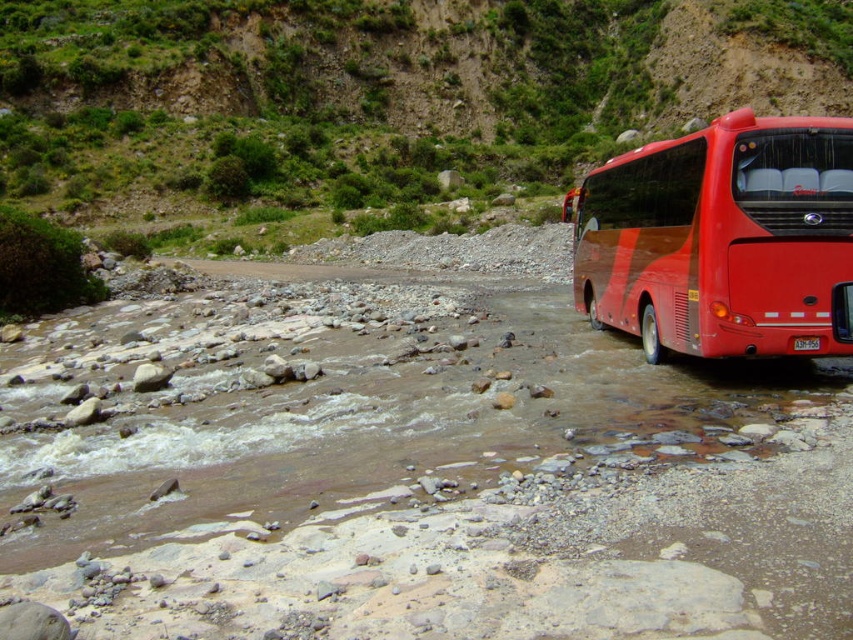
Is point (303, 147) in front of point (416, 278)?

That is False.

Does green grassy hillside at upper center appear on the left side of dirt/gravel path at center?

Incorrect, green grassy hillside at upper center is not on the left side of dirt/gravel path at center.

Is point (347, 72) behind point (334, 278)?

Yes.

The image size is (853, 640). Identify the location of green grassy hillside at upper center. (376, 100).

Between point (68, 77) and point (718, 188), which one is positioned in front?

Point (718, 188)

Does green grassy hillside at upper center have a lesser width compared to red glossy bus at right?

No, green grassy hillside at upper center is not thinner than red glossy bus at right.

This screenshot has height=640, width=853. In order to click on green grassy hillside at upper center in this screenshot , I will do `click(376, 100)`.

I want to click on green grassy hillside at upper center, so click(376, 100).

How far apart are red glossy bus at right and dirt/gravel path at center?

66.37 feet

Is red glossy bus at right bigger than dirt/gravel path at center?

No.

Which is behind, point (842, 148) or point (413, 268)?

The point (413, 268) is behind.

Image resolution: width=853 pixels, height=640 pixels. Find the location of `red glossy bus at right`. red glossy bus at right is located at coordinates (722, 240).